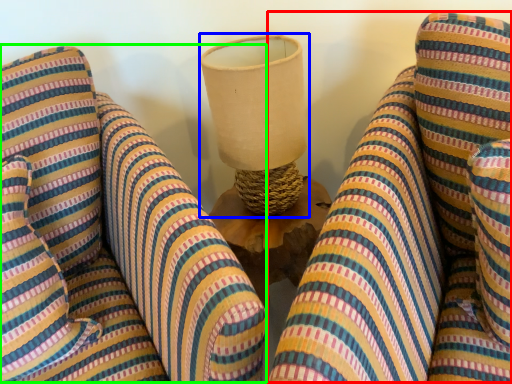
Question: Which is nearer to the bean bag chair (highlighted by a red box)? table lamp (highlighted by a blue box) or bean bag chair (highlighted by a green box).

Choices:
 (A) table lamp
 (B) bean bag chair

Answer: (A)